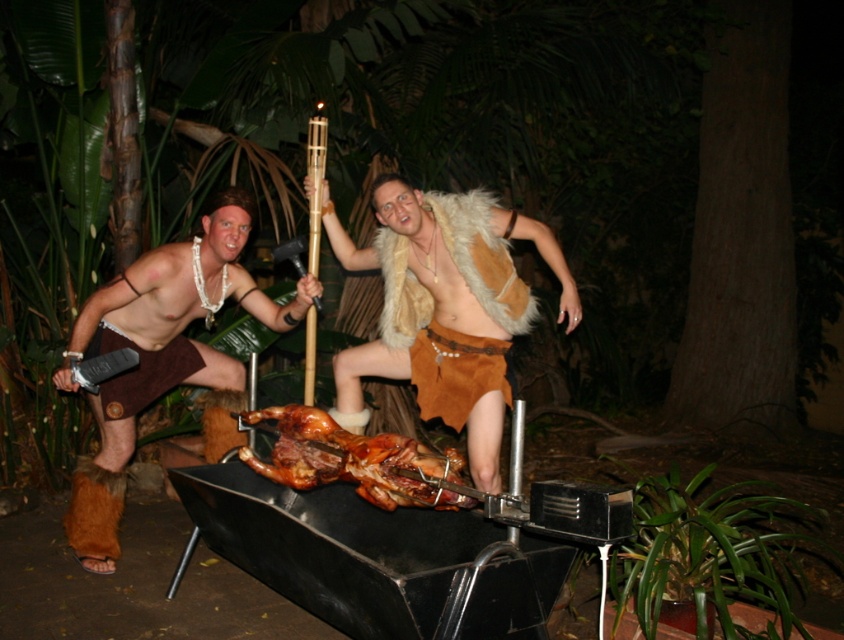
You are a photographer trying to capture a group shot of the two individuals in the scene. Since the fur vest at center is in the middle and the brown leather shorts at left is to the left of it, where should you position yourself to ensure both are framed properly?

To frame both the brown leather shorts at left and the fur vest at center properly, position yourself to the right of the fur vest at center so that the brown leather shorts at left is on the left side of the frame and the fur vest at center is centered.

What object is located at the coordinates point (161, 352) in the image?

The point (161, 352) indicates brown leather shorts at left.